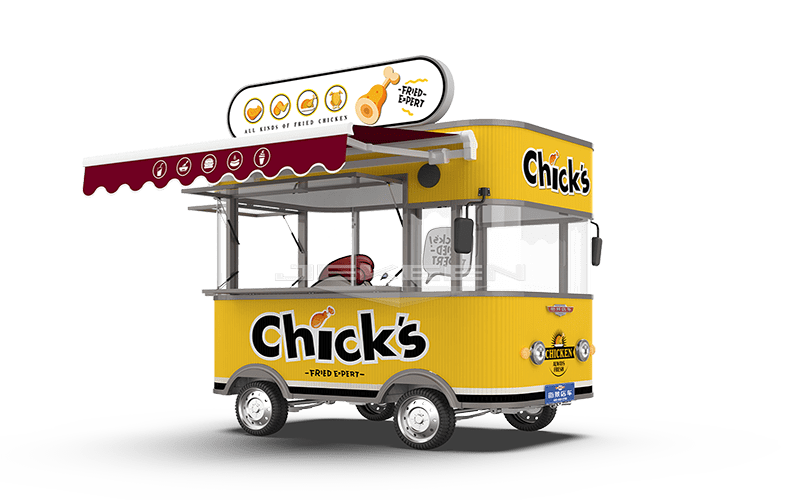
Locate an element on the screen. This screenshot has height=500, width=800. glass is located at coordinates (290, 256).